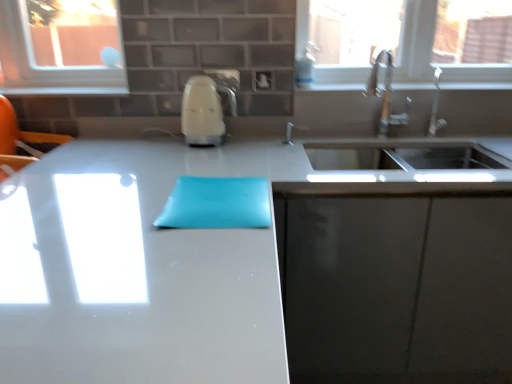
Question: Does white glossy countertop at center lie behind white glossy window sill at upper center?

Choices:
 (A) yes
 (B) no

Answer: (B)

Question: Is the position of white glossy countertop at center less distant than that of white glossy window sill at upper center?

Choices:
 (A) no
 (B) yes

Answer: (B)

Question: Does white glossy countertop at center have a greater height compared to white glossy window sill at upper center?

Choices:
 (A) no
 (B) yes

Answer: (B)

Question: Are white glossy countertop at center and white glossy window sill at upper center beside each other?

Choices:
 (A) yes
 (B) no

Answer: (B)

Question: Would you say white glossy countertop at center is a long distance from white glossy window sill at upper center?

Choices:
 (A) no
 (B) yes

Answer: (A)

Question: Is white glossy countertop at center at the right side of white glossy window sill at upper center?

Choices:
 (A) no
 (B) yes

Answer: (A)

Question: Considering the relative sizes of white glossy kettle at center and matte gray cabinet at lower right in the image provided, is white glossy kettle at center taller than matte gray cabinet at lower right?

Choices:
 (A) no
 (B) yes

Answer: (A)

Question: Is there a large distance between white glossy kettle at center and matte gray cabinet at lower right?

Choices:
 (A) no
 (B) yes

Answer: (A)

Question: Is white glossy kettle at center aimed at matte gray cabinet at lower right?

Choices:
 (A) no
 (B) yes

Answer: (A)

Question: Does white glossy kettle at center have a lesser width compared to matte gray cabinet at lower right?

Choices:
 (A) no
 (B) yes

Answer: (B)

Question: Does white glossy kettle at center have a larger size compared to matte gray cabinet at lower right?

Choices:
 (A) no
 (B) yes

Answer: (A)

Question: Is white glossy kettle at center not inside matte gray cabinet at lower right?

Choices:
 (A) no
 (B) yes

Answer: (B)

Question: Are transparent glass window at upper right and satin nickel faucet at upper right beside each other?

Choices:
 (A) no
 (B) yes

Answer: (A)